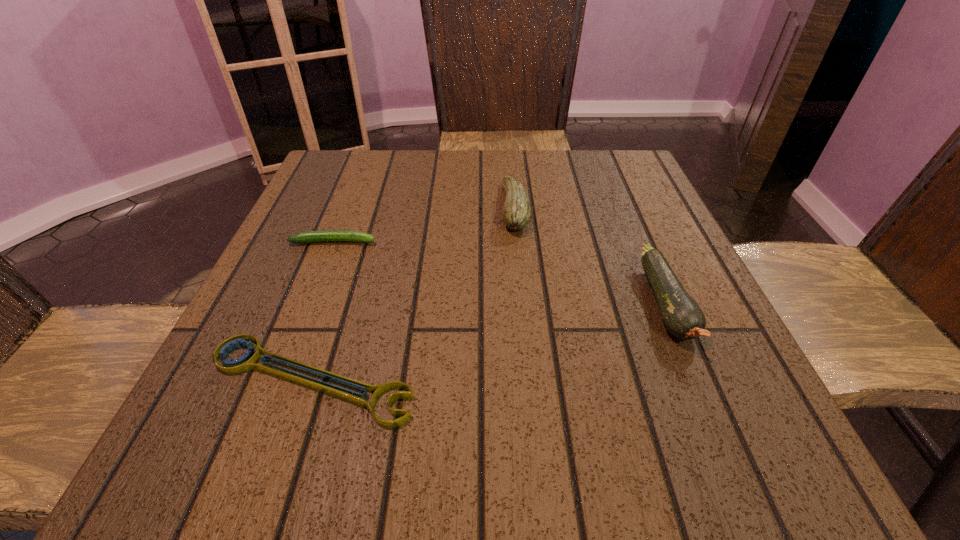
Locate an element on the screen. vacant space at the near edge is located at coordinates (468, 428).

Image resolution: width=960 pixels, height=540 pixels. I want to click on vacant space at the left edge of the desktop, so click(244, 406).

At what (x,y) coordinates should I click in order to perform the action: click on vacant space at the right edge. Please return your answer as a coordinate pair (x, y). Looking at the image, I should click on (716, 316).

At what (x,y) coordinates should I click in order to perform the action: click on blank space at the far left corner. Please return your answer as a coordinate pair (x, y). Image resolution: width=960 pixels, height=540 pixels. Looking at the image, I should click on (328, 191).

In the image, there is a desktop. Where is `free space at the far right corner`? Image resolution: width=960 pixels, height=540 pixels. free space at the far right corner is located at coordinates (575, 160).

The width and height of the screenshot is (960, 540). Identify the location of unoccupied area between the shortest object and the leftmost zucchini. pos(323,310).

Identify the location of vacant area between the farthest zucchini and the wrench. The height and width of the screenshot is (540, 960). (413, 294).

Locate an element on the screen. free space that is in between the third object from left to right and the rightmost object is located at coordinates (590, 256).

Identify the location of free space between the nearest zucchini and the second zucchini from right to left. The image size is (960, 540). (590, 256).

Where is `free space between the shortest object and the second object from right to left`? free space between the shortest object and the second object from right to left is located at coordinates (413, 294).